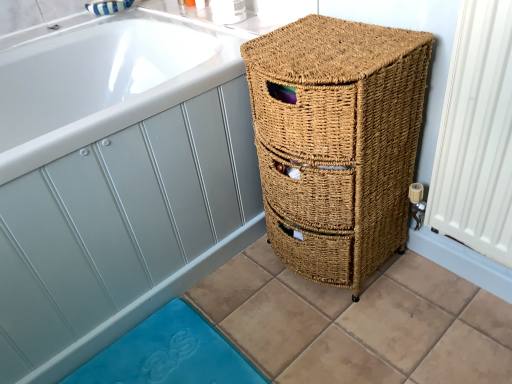
Question: Considering the relative sizes of natural woven basket at right and natural woven basket at right in the image provided, is natural woven basket at right bigger than natural woven basket at right?

Choices:
 (A) no
 (B) yes

Answer: (B)

Question: Considering the relative sizes of natural woven basket at right and natural woven basket at right in the image provided, is natural woven basket at right wider than natural woven basket at right?

Choices:
 (A) no
 (B) yes

Answer: (B)

Question: From a real-world perspective, is natural woven basket at right beneath natural woven basket at right?

Choices:
 (A) yes
 (B) no

Answer: (A)

Question: Is natural woven basket at right at the right side of natural woven basket at right?

Choices:
 (A) no
 (B) yes

Answer: (A)

Question: Is natural woven basket at right not inside natural woven basket at right?

Choices:
 (A) yes
 (B) no

Answer: (A)

Question: From the image's perspective, would you say natural woven basket at right is shown under natural woven basket at right?

Choices:
 (A) yes
 (B) no

Answer: (B)

Question: Is natural woven basket at right surrounding blue rubber bath mat at lower left?

Choices:
 (A) no
 (B) yes

Answer: (A)

Question: Is natural woven basket at right to the left of blue rubber bath mat at lower left from the viewer's perspective?

Choices:
 (A) yes
 (B) no

Answer: (A)

Question: Is natural woven basket at right bigger than blue rubber bath mat at lower left?

Choices:
 (A) no
 (B) yes

Answer: (B)

Question: Does natural woven basket at right have a greater height compared to blue rubber bath mat at lower left?

Choices:
 (A) yes
 (B) no

Answer: (A)

Question: Is natural woven basket at right next to blue rubber bath mat at lower left?

Choices:
 (A) no
 (B) yes

Answer: (A)

Question: Is natural woven basket at right thinner than blue rubber bath mat at lower left?

Choices:
 (A) no
 (B) yes

Answer: (A)

Question: Is natural woven basket at right positioned before natural woven basket at right?

Choices:
 (A) yes
 (B) no

Answer: (B)